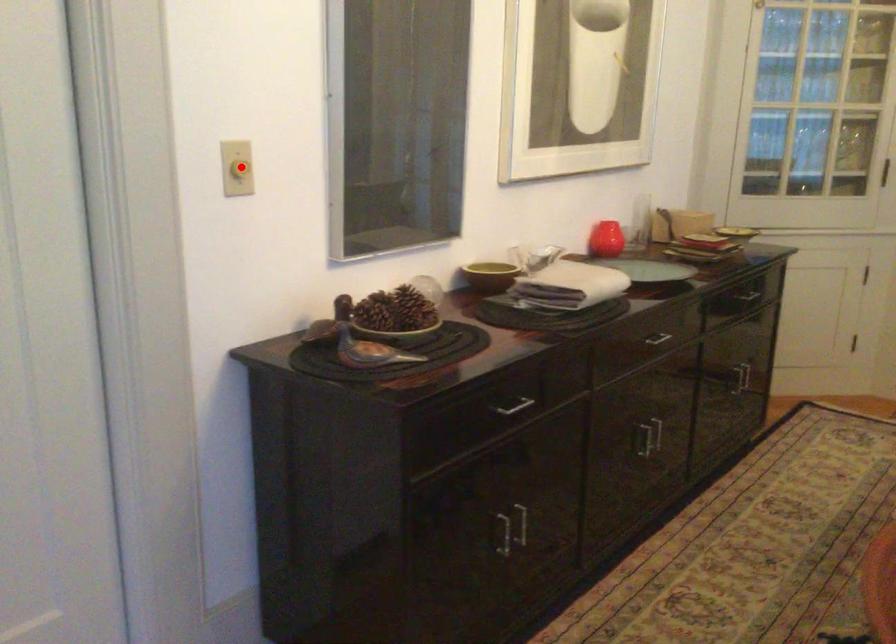
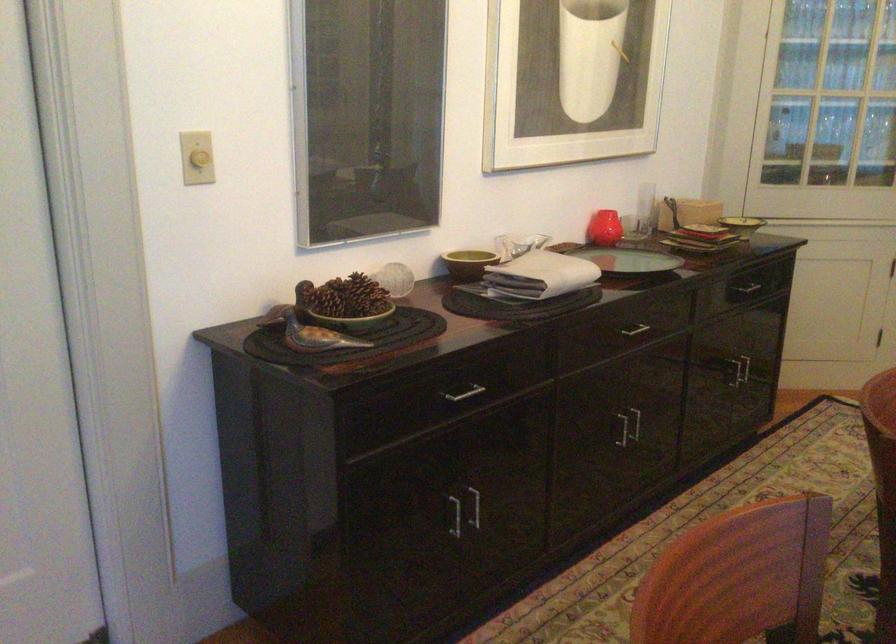
Where in the second image is the point corresponding to the highlighted location from the first image?

(200, 158)